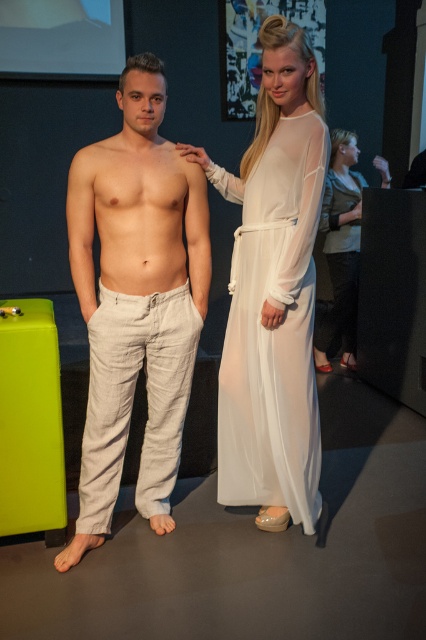
Question: Can you confirm if white sheer dress at center is positioned to the right of beige linen pants at center?

Choices:
 (A) no
 (B) yes

Answer: (B)

Question: Which point appears farthest from the camera in this image?

Choices:
 (A) (270, 38)
 (B) (356, 289)
 (C) (104, 509)

Answer: (B)

Question: Considering the relative positions of white sheer dress at center and light beige linen pants at center in the image provided, where is white sheer dress at center located with respect to light beige linen pants at center?

Choices:
 (A) below
 (B) above

Answer: (A)

Question: Which object appears closest to the camera in this image?

Choices:
 (A) muscle at center
 (B) light beige linen pants at left
 (C) silky white dress at center

Answer: (B)

Question: Considering the relative positions of beige linen pants at center and muscle at center in the image provided, where is beige linen pants at center located with respect to muscle at center?

Choices:
 (A) left
 (B) right

Answer: (A)

Question: Which point appears farthest from the camera in this image?

Choices:
 (A) (109, 280)
 (B) (333, 273)
 (C) (117, 209)

Answer: (B)